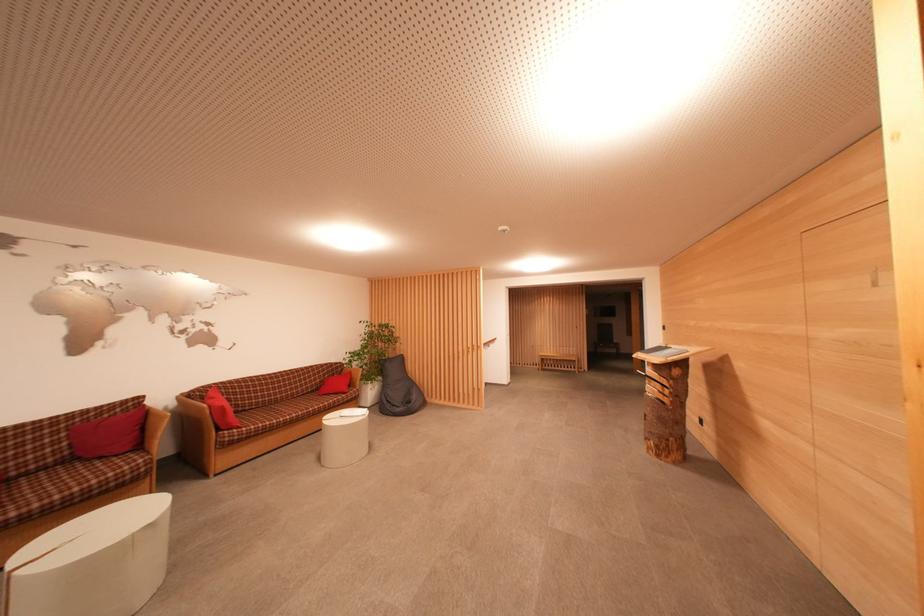
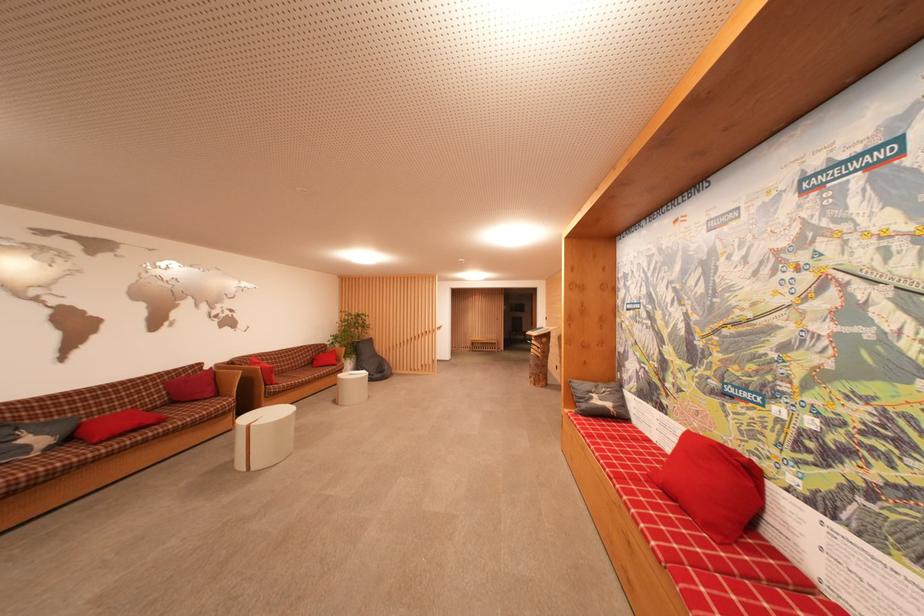
In the second image, find the point that corresponds to the point at 354,376 in the first image.

(338, 354)